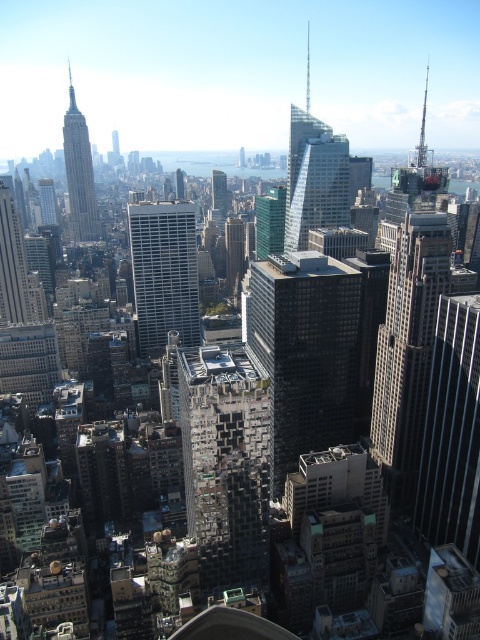
Question: Which of the following is the farthest from the observer?

Choices:
 (A) green glass skyscraper at center
 (B) white glass skyscraper at center

Answer: (A)

Question: Does black glass skyscraper at center appear over green glass skyscraper at center?

Choices:
 (A) no
 (B) yes

Answer: (A)

Question: Is black glass skyscraper at center bigger than matte glass skyscraper at upper left?

Choices:
 (A) no
 (B) yes

Answer: (B)

Question: Which point appears closest to the camera in this image?

Choices:
 (A) (218, 177)
 (B) (85, 228)
 (C) (184, 296)

Answer: (C)

Question: Which point appears closest to the camera in this image?

Choices:
 (A) (217, 200)
 (B) (181, 317)
 (C) (299, 280)
 (D) (82, 218)

Answer: (C)

Question: Does white glass skyscraper at center appear under matte glass skyscraper at upper left?

Choices:
 (A) no
 (B) yes

Answer: (B)